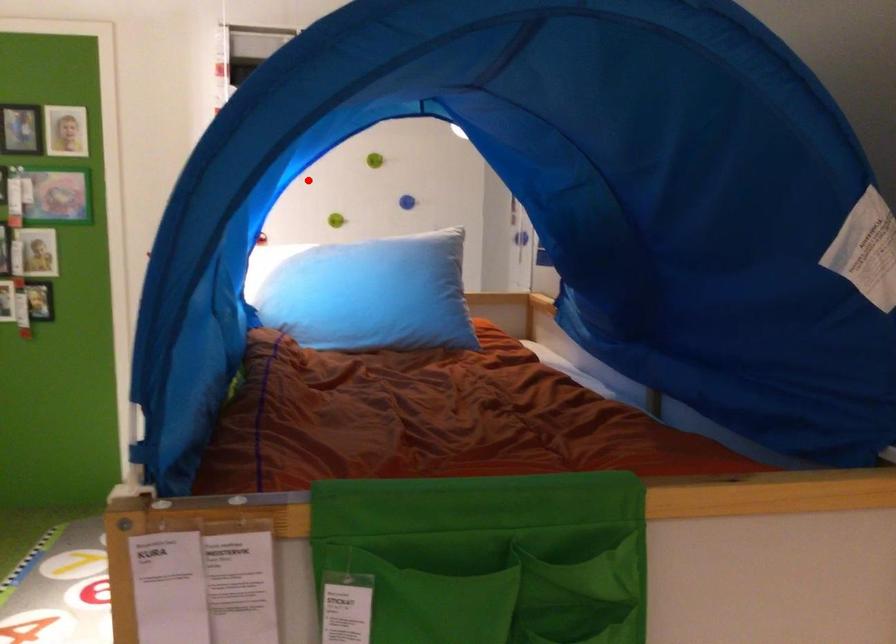
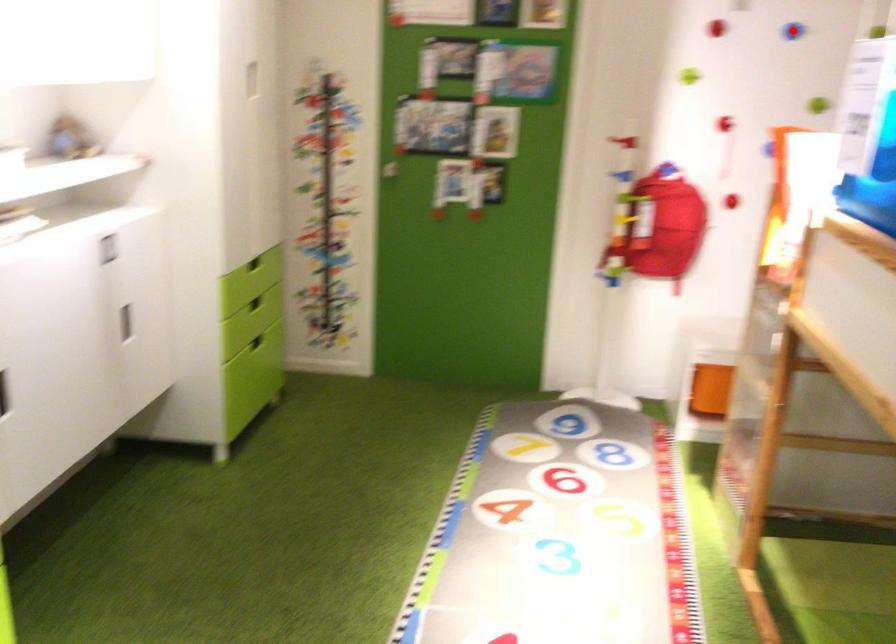
I am providing you with two images of the same scene from different viewpoints. A red point is marked on the first image and another point is marked on the second image. Do the highlighted points in image1 and image2 indicate the same real-world spot?

Yes